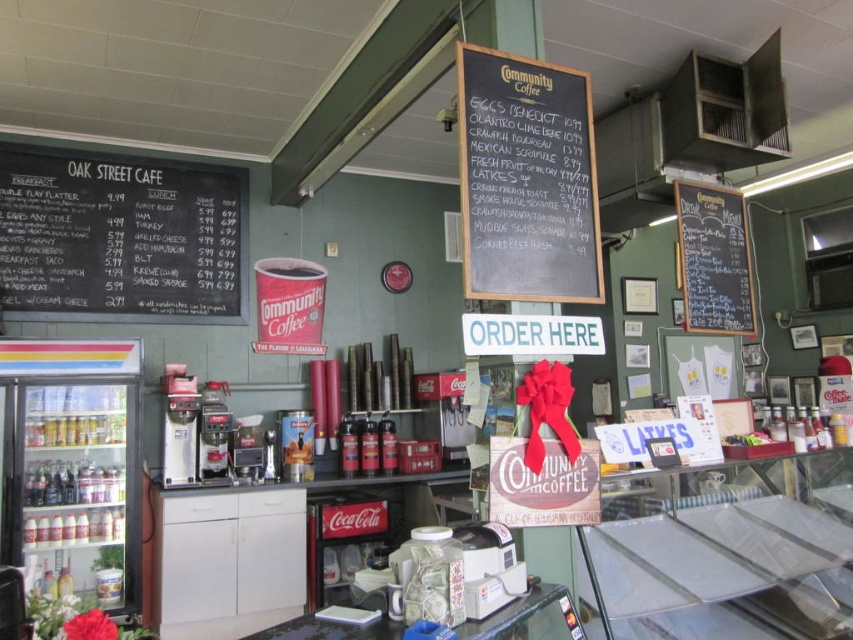
You are a customer standing at the entrance of Community Coffee and want to read both the black chalkboard menu at left and the black chalkboard at upper center. Which chalkboard will you see first as you walk towards the counter?

You will see the black chalkboard menu at left first because it is closer to you than the black chalkboard at upper center, which is further away.